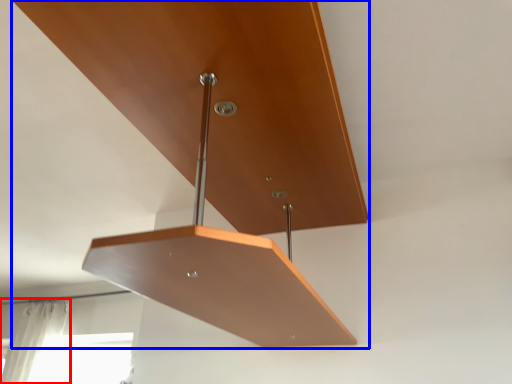
Question: Which point is further to the camera, curtain (highlighted by a red box) or furniture (highlighted by a blue box)?

Choices:
 (A) curtain
 (B) furniture

Answer: (A)